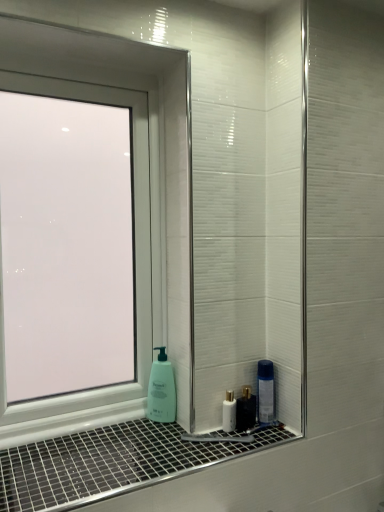
Question: Is transparent glass window at left surrounding white glossy mouthwash at lower center?

Choices:
 (A) yes
 (B) no

Answer: (B)

Question: Is transparent glass window at left bigger than white glossy mouthwash at lower center?

Choices:
 (A) yes
 (B) no

Answer: (A)

Question: Is transparent glass window at left oriented away from white glossy mouthwash at lower center?

Choices:
 (A) yes
 (B) no

Answer: (B)

Question: Can you confirm if transparent glass window at left is wider than white glossy mouthwash at lower center?

Choices:
 (A) yes
 (B) no

Answer: (A)

Question: Is transparent glass window at left shorter than white glossy mouthwash at lower center?

Choices:
 (A) no
 (B) yes

Answer: (A)

Question: Choose the correct answer: Is transparent glass window at left inside green matte soap dispenser at lower center or outside it?

Choices:
 (A) inside
 (B) outside

Answer: (B)

Question: From the image's perspective, is transparent glass window at left located above or below green matte soap dispenser at lower center?

Choices:
 (A) below
 (B) above

Answer: (B)

Question: Is transparent glass window at left wider or thinner than green matte soap dispenser at lower center?

Choices:
 (A) thin
 (B) wide

Answer: (B)

Question: Is transparent glass window at left taller or shorter than green matte soap dispenser at lower center?

Choices:
 (A) tall
 (B) short

Answer: (A)

Question: Considering their positions, is white glossy mouthwash at lower center located in front of or behind transparent glass window at left?

Choices:
 (A) behind
 (B) front

Answer: (A)

Question: From a real-world perspective, is white glossy mouthwash at lower center positioned above or below transparent glass window at left?

Choices:
 (A) below
 (B) above

Answer: (A)

Question: Is white glossy mouthwash at lower center spatially inside transparent glass window at left, or outside of it?

Choices:
 (A) outside
 (B) inside

Answer: (A)

Question: In the image, is white glossy mouthwash at lower center on the left side or the right side of transparent glass window at left?

Choices:
 (A) left
 (B) right

Answer: (B)

Question: From the image's perspective, is green matte soap dispenser at lower center located above or below white glossy window sill at lower center?

Choices:
 (A) above
 (B) below

Answer: (A)

Question: Considering their positions, is green matte soap dispenser at lower center located in front of or behind white glossy window sill at lower center?

Choices:
 (A) behind
 (B) front

Answer: (A)